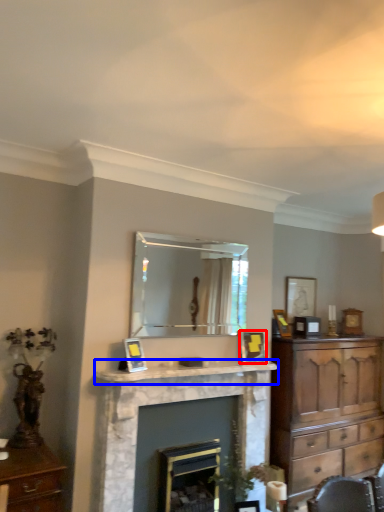
Question: Which object is further to the camera taking this photo, picture frame (highlighted by a red box) or mantle (highlighted by a blue box)?

Choices:
 (A) picture frame
 (B) mantle

Answer: (A)